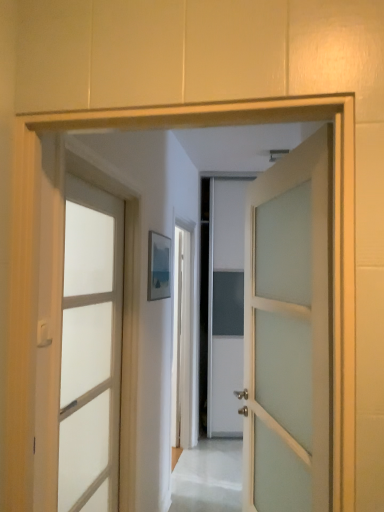
Question: Is translucent glass door at center, the 1th door from the left, in front of or behind white frosted glass door at center, the second door viewed from the left, in the image?

Choices:
 (A) front
 (B) behind

Answer: (B)

Question: Is point (117, 458) closer or farther from the camera than point (329, 340)?

Choices:
 (A) farther
 (B) closer

Answer: (A)

Question: Which object is positioned closest to the matte white door handle at left?

Choices:
 (A) translucent glass door at center, the 1th door from the left
 (B) white frosted glass door at center, the second door viewed from the left

Answer: (A)

Question: Considering the real-world distances, which object is farthest from the matte white door handle at left?

Choices:
 (A) translucent glass door at center, the 1th door from the left
 (B) white frosted glass door at center, which is the 1th door in right-to-left order

Answer: (B)